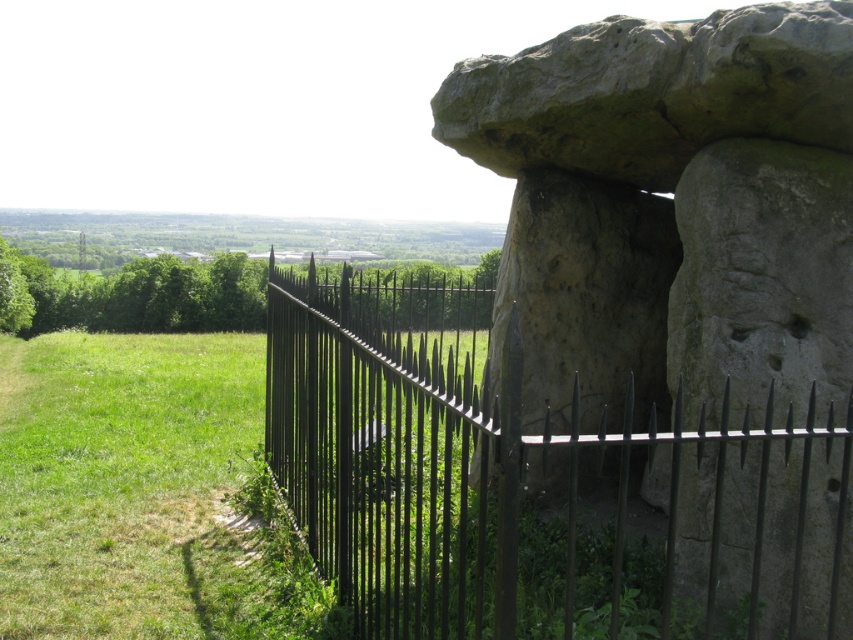
Question: Which point is closer to the camera taking this photo?

Choices:
 (A) (720, 237)
 (B) (345, 440)

Answer: (A)

Question: Observing the image, what is the correct spatial positioning of gray stone structure at center in reference to black metal fence at center?

Choices:
 (A) above
 (B) below

Answer: (A)

Question: Can you confirm if gray stone structure at center is positioned below black metal fence at center?

Choices:
 (A) no
 (B) yes

Answer: (A)

Question: Is gray stone structure at center to the left of black metal fence at center from the viewer's perspective?

Choices:
 (A) yes
 (B) no

Answer: (B)

Question: Which object appears farthest from the camera in this image?

Choices:
 (A) black metal fence at center
 (B) gray stone structure at center

Answer: (B)